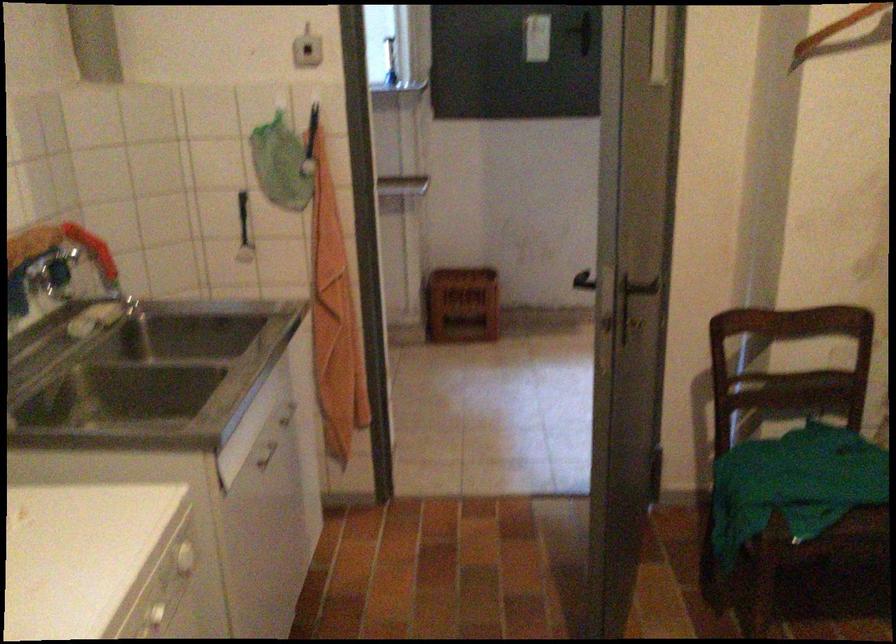
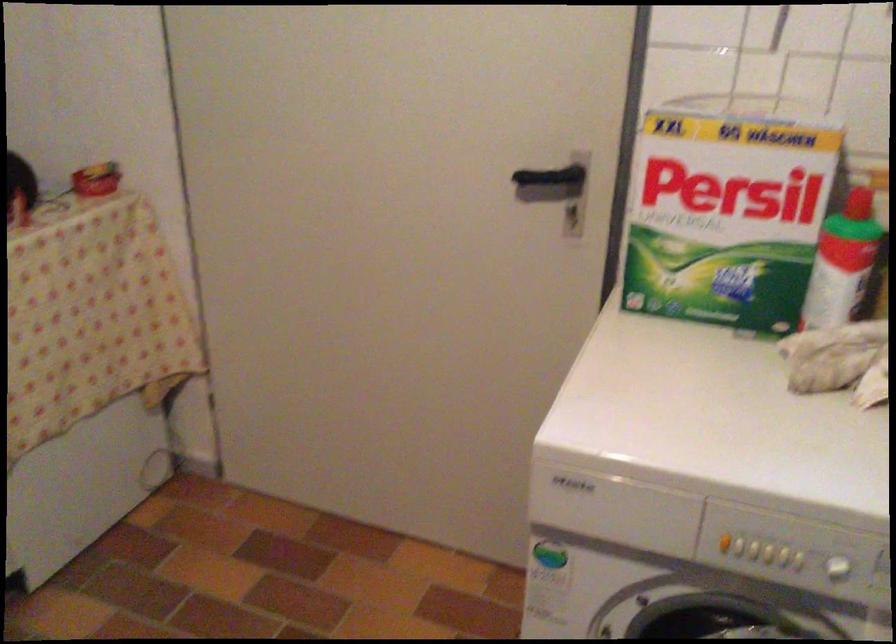
The first image is from the beginning of the video and the second image is from the end. How did the camera likely rotate when shooting the video?

The camera rotated toward left-down.